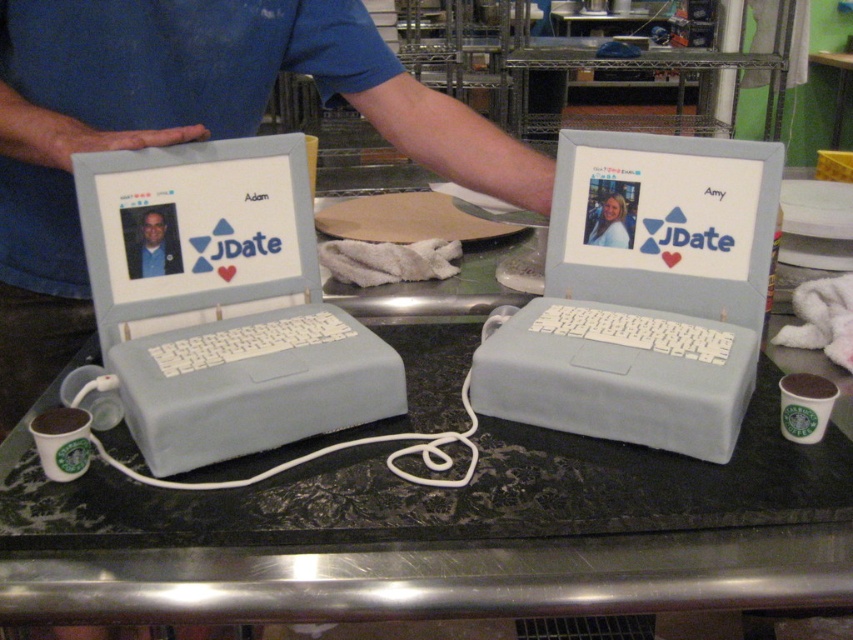
Please look at the two laptop cake designs on the dark textured countertop. Which of the cakes is closer to the point at coordinate point (x=442, y=532)?

The point at coordinate point (x=442, y=532) indicates black marble counter top at center, so the cake closer to this point would be the one nearest to the center of the counter.

Based on the photo, you are a photographer positioned at the center of the scene. You want to capture a closeup shot of the blue fabric shirt at upper left. Based on its 2D coordinates, which direction should you move your camera to focus on it?

The blue fabric shirt at upper left is located at coordinates point (184, 131). Since the photographer is at the center of the scene, they should move the camera slightly to the upper left direction to focus on the blue fabric shirt at upper left.